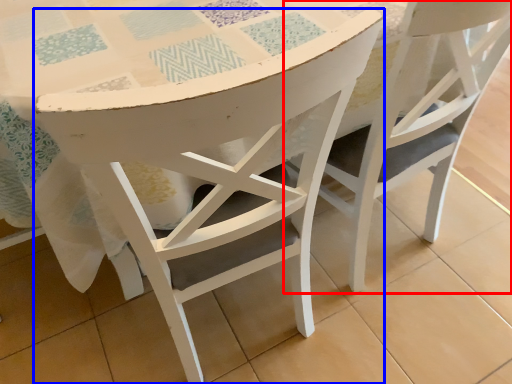
Question: Among these objects, which one is farthest to the camera, chair (highlighted by a red box) or chair (highlighted by a blue box)?

Choices:
 (A) chair
 (B) chair

Answer: (A)